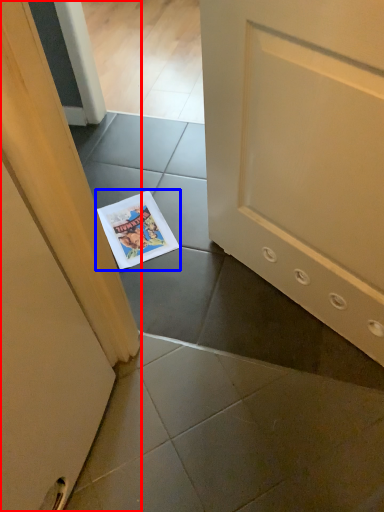
Question: Among these objects, which one is nearest to the camera, door (highlighted by a red box) or comic book (highlighted by a blue box)?

Choices:
 (A) door
 (B) comic book

Answer: (A)